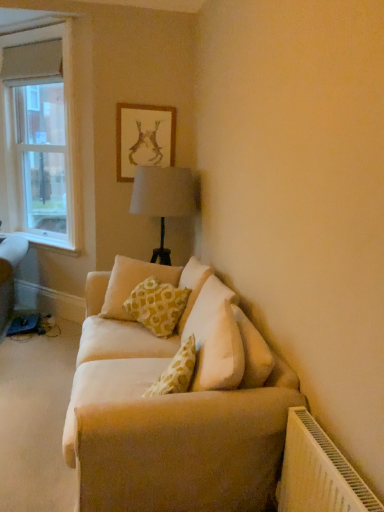
Question: From the image's perspective, is beige fabric couch at center over yellow printed cushion at center?

Choices:
 (A) no
 (B) yes

Answer: (A)

Question: From a real-world perspective, is beige fabric couch at center under yellow printed cushion at center?

Choices:
 (A) yes
 (B) no

Answer: (A)

Question: Considering the relative positions of beige fabric couch at center and yellow printed cushion at center in the image provided, is beige fabric couch at center to the left of yellow printed cushion at center from the viewer's perspective?

Choices:
 (A) yes
 (B) no

Answer: (A)

Question: Is yellow printed cushion at center completely or partially inside beige fabric couch at center?

Choices:
 (A) no
 (B) yes

Answer: (A)

Question: Is beige fabric couch at center shorter than yellow printed cushion at center?

Choices:
 (A) yes
 (B) no

Answer: (A)

Question: From the image's perspective, is beige fabric couch at center below yellow printed cushion at center?

Choices:
 (A) no
 (B) yes

Answer: (B)

Question: Can beige fabric couch at center be found inside gold-framed artwork at upper center?

Choices:
 (A) no
 (B) yes

Answer: (A)

Question: Is gold-framed artwork at upper center thinner than beige fabric couch at center?

Choices:
 (A) yes
 (B) no

Answer: (A)

Question: Does gold-framed artwork at upper center have a greater height compared to beige fabric couch at center?

Choices:
 (A) yes
 (B) no

Answer: (A)

Question: Is the surface of gold-framed artwork at upper center in direct contact with beige fabric couch at center?

Choices:
 (A) yes
 (B) no

Answer: (B)

Question: From the image's perspective, is gold-framed artwork at upper center located beneath beige fabric couch at center?

Choices:
 (A) yes
 (B) no

Answer: (B)

Question: Is gold-framed artwork at upper center closer to the viewer compared to beige fabric couch at center?

Choices:
 (A) no
 (B) yes

Answer: (A)

Question: Considering the relative positions of clear glass window at left and yellow printed cushion at center in the image provided, is clear glass window at left to the left of yellow printed cushion at center from the viewer's perspective?

Choices:
 (A) yes
 (B) no

Answer: (A)